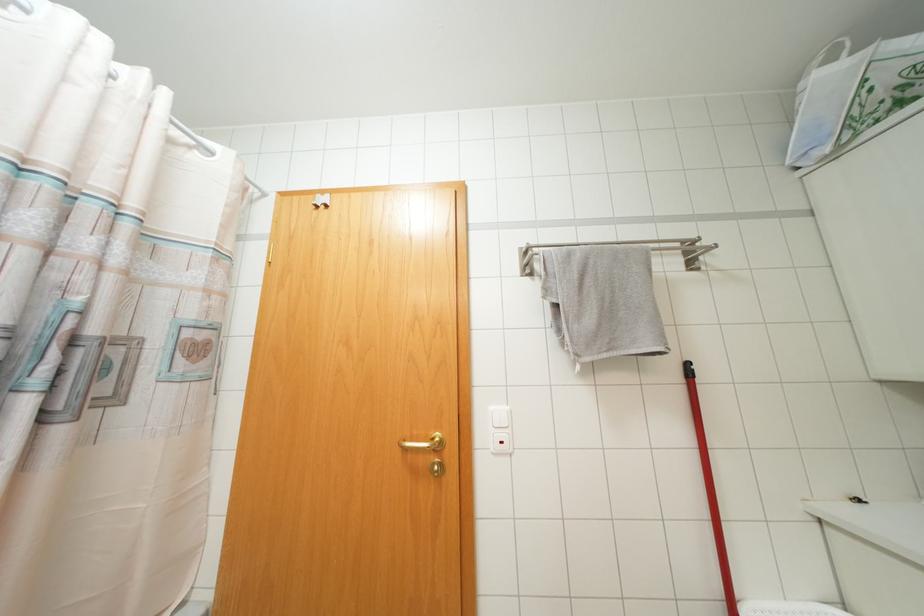
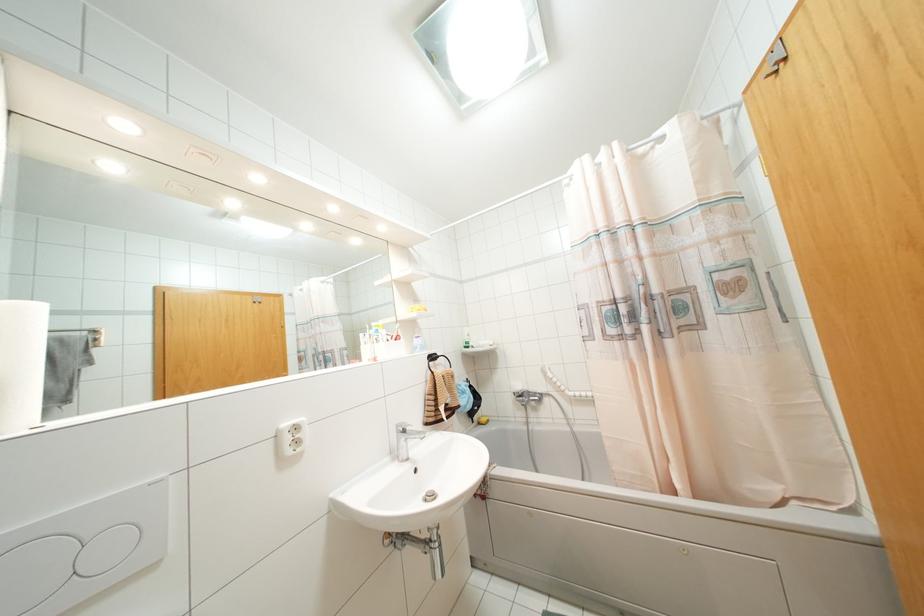
In the second image, find the point that corresponds to the point at 325,206 in the first image.

(784, 58)